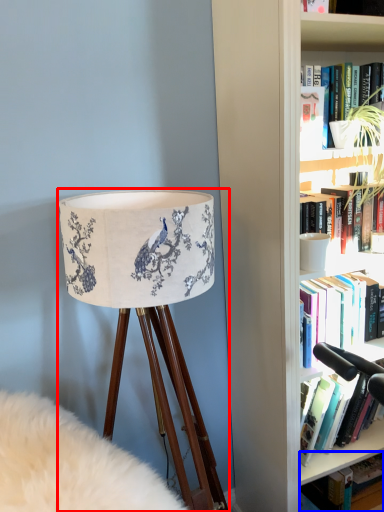
Question: Which object is closer to the camera taking this photo, lamp (highlighted by a red box) or book (highlighted by a blue box)?

Choices:
 (A) lamp
 (B) book

Answer: (A)